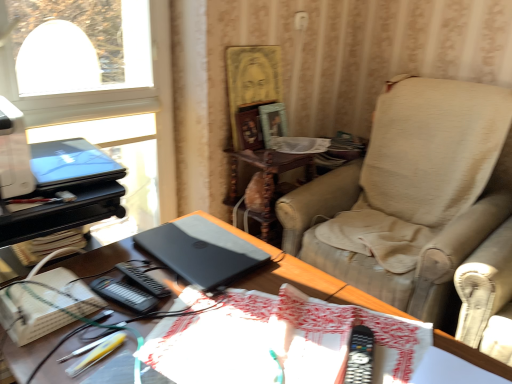
Question: From the image's perspective, does wooden side table at center appear lower than matte black laptop at upper left, which is counted as the 1th laptop, starting from the top?

Choices:
 (A) yes
 (B) no

Answer: (A)

Question: Is wooden side table at center smaller than matte black laptop at upper left, marked as the second laptop in a right-to-left arrangement?

Choices:
 (A) no
 (B) yes

Answer: (A)

Question: Is wooden side table at center shorter than matte black laptop at upper left, marked as the second laptop in a right-to-left arrangement?

Choices:
 (A) no
 (B) yes

Answer: (A)

Question: Can you confirm if wooden side table at center is taller than matte black laptop at upper left, the 2th laptop positioned from the bottom?

Choices:
 (A) yes
 (B) no

Answer: (A)

Question: Considering the relative positions of wooden side table at center and matte black laptop at upper left, the first laptop when ordered from left to right, in the image provided, is wooden side table at center behind matte black laptop at upper left, the first laptop when ordered from left to right,?

Choices:
 (A) yes
 (B) no

Answer: (A)

Question: Is wooden side table at center turned away from matte black laptop at upper left, which is counted as the 1th laptop, starting from the top?

Choices:
 (A) yes
 (B) no

Answer: (B)

Question: Is matte black laptop at upper left, the 2th laptop positioned from the bottom, not within satin black laptop at center?

Choices:
 (A) no
 (B) yes

Answer: (B)

Question: Considering the relative sizes of matte black laptop at upper left, marked as the second laptop in a right-to-left arrangement, and satin black laptop at center in the image provided, is matte black laptop at upper left, marked as the second laptop in a right-to-left arrangement, bigger than satin black laptop at center?

Choices:
 (A) no
 (B) yes

Answer: (A)

Question: Considering the relative sizes of matte black laptop at upper left, the 2th laptop positioned from the bottom, and satin black laptop at center in the image provided, is matte black laptop at upper left, the 2th laptop positioned from the bottom, shorter than satin black laptop at center?

Choices:
 (A) yes
 (B) no

Answer: (A)

Question: Is the surface of matte black laptop at upper left, the first laptop when ordered from left to right, in direct contact with satin black laptop at center?

Choices:
 (A) yes
 (B) no

Answer: (B)

Question: Can you confirm if matte black laptop at upper left, marked as the second laptop in a right-to-left arrangement, is wider than satin black laptop at center?

Choices:
 (A) no
 (B) yes

Answer: (A)

Question: Is matte black laptop at upper left, the first laptop when ordered from left to right, positioned in front of satin black laptop at center?

Choices:
 (A) no
 (B) yes

Answer: (A)

Question: Is satin black laptop at center at the right side of white cardboard book at lower left?

Choices:
 (A) yes
 (B) no

Answer: (A)